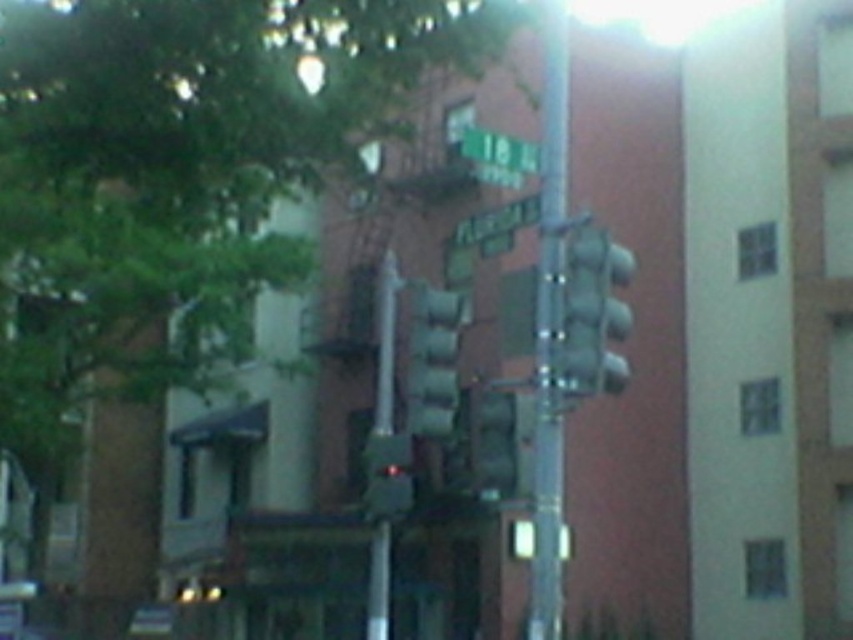
You are a city planner assessing the placement of the metallic silver pole at center and the green matte traffic light at center. Considering their heights, which one should be adjusted to ensure proper visibility for pedestrians?

The metallic silver pole at center is much taller than the green matte traffic light at center. To ensure proper visibility, the green matte traffic light at center should be adjusted to be taller so it can be seen clearly by pedestrians.

You are standing at the traffic light pole in the urban street scene. You notice a point marked at coordinates (178, 176). Which object does this point correspond to?

The point at coordinates (178, 176) corresponds to the green leafy tree at upper left.

You are a pedestrian standing on the sidewalk and want to cross the street. You notice a green leafy tree at upper left and a metallic gray traffic light at center. Which object is higher in the image?

The green leafy tree at upper left is located above the metallic gray traffic light at center, making it higher in the image.